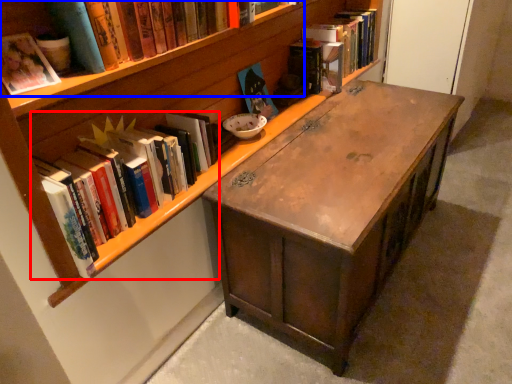
Question: Which object appears farthest to the camera in this image, book (highlighted by a red box) or book (highlighted by a blue box)?

Choices:
 (A) book
 (B) book

Answer: (A)